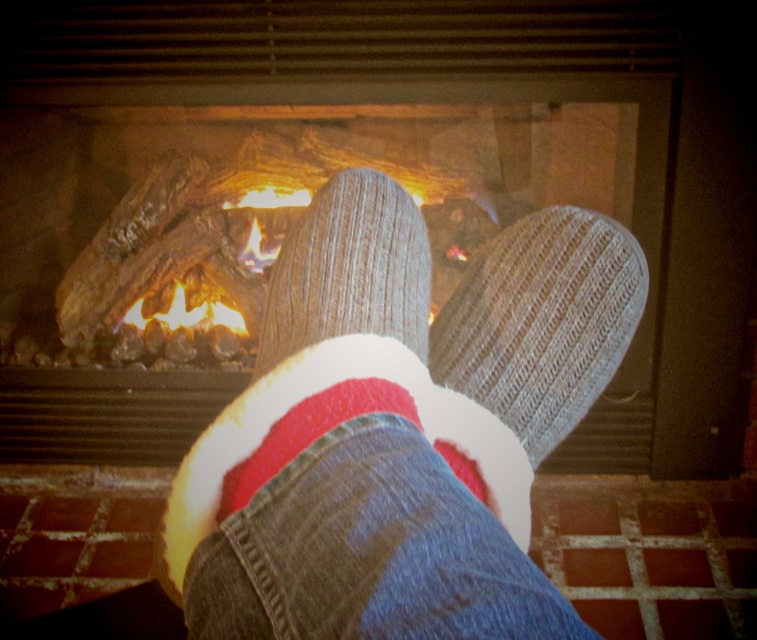
You are sitting in front of the fireplace and want to see your socks clearly. Which object, the wooden logs at center or the knit socks at center, is closer to you?

The wooden logs at center are closer to you than the knit socks at center, so you can see the wooden logs at center more clearly.

You are trying to determine which sock is closer to you in the image. Both the knitted socks at center and the white fleece sock at center are visible. Which one appears closer to your viewpoint?

The knitted socks at center appears closer to your viewpoint because it is positioned in front of the white fleece sock at center.